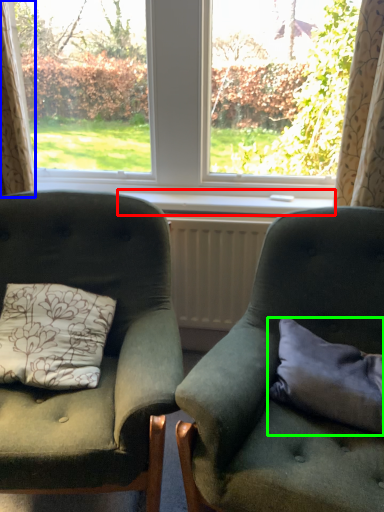
Question: Considering the real-world distances, which object is farthest from window sill (highlighted by a red box)? curtain (highlighted by a blue box) or pillow (highlighted by a green box)?

Choices:
 (A) curtain
 (B) pillow

Answer: (B)